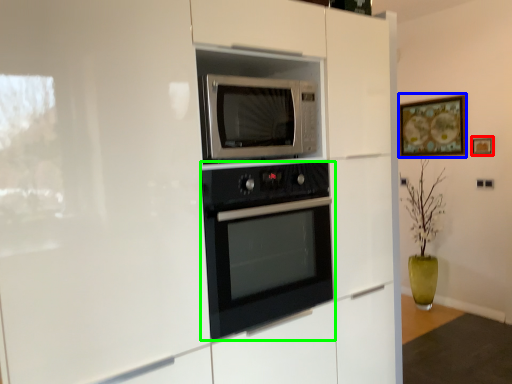
Question: Which is farther away from picture frame (highlighted by a red box)? picture frame (highlighted by a blue box) or oven (highlighted by a green box)?

Choices:
 (A) picture frame
 (B) oven

Answer: (B)